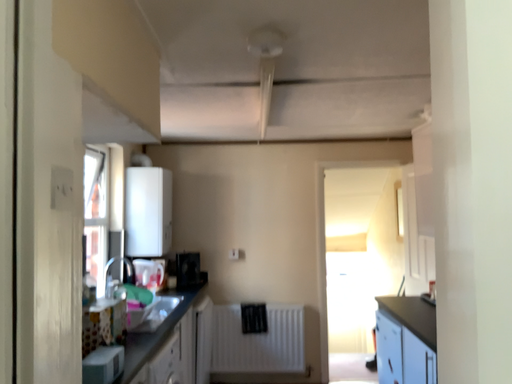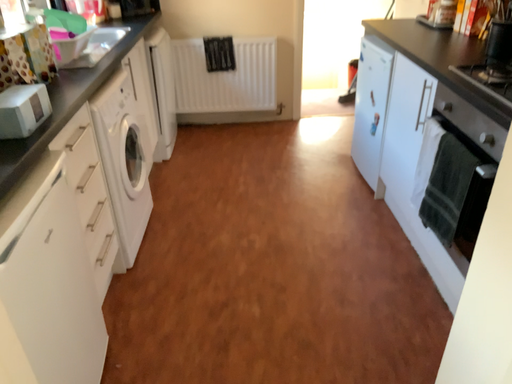
Question: Which way did the camera rotate in the video?

Choices:
 (A) rotated downward
 (B) rotated upward

Answer: (A)